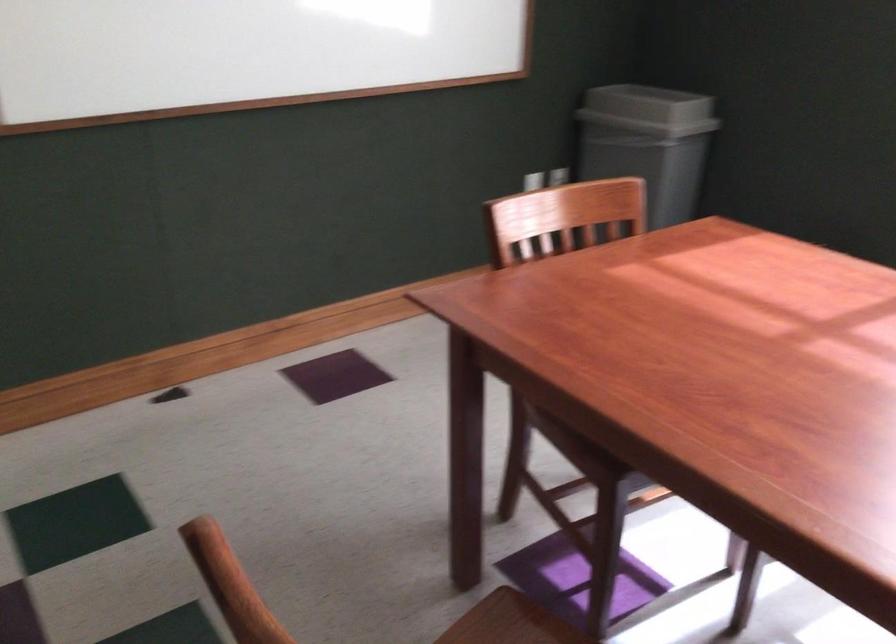
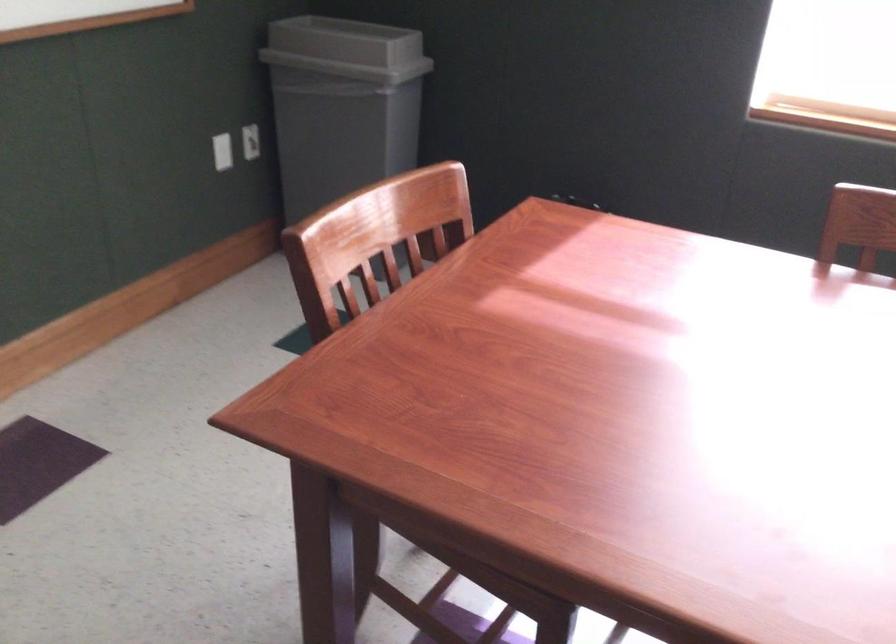
Find the pixel in the second image that matches the point at 633,105 in the first image.

(346, 49)